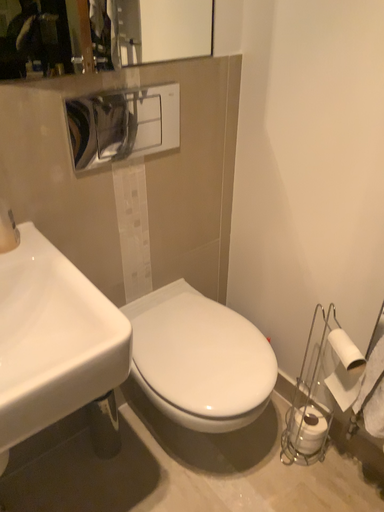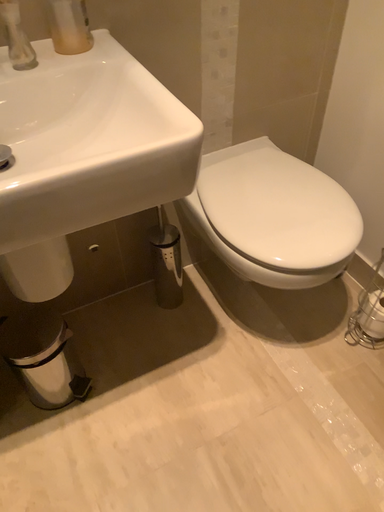
Question: Which way did the camera rotate in the video?

Choices:
 (A) rotated upward
 (B) rotated downward

Answer: (B)